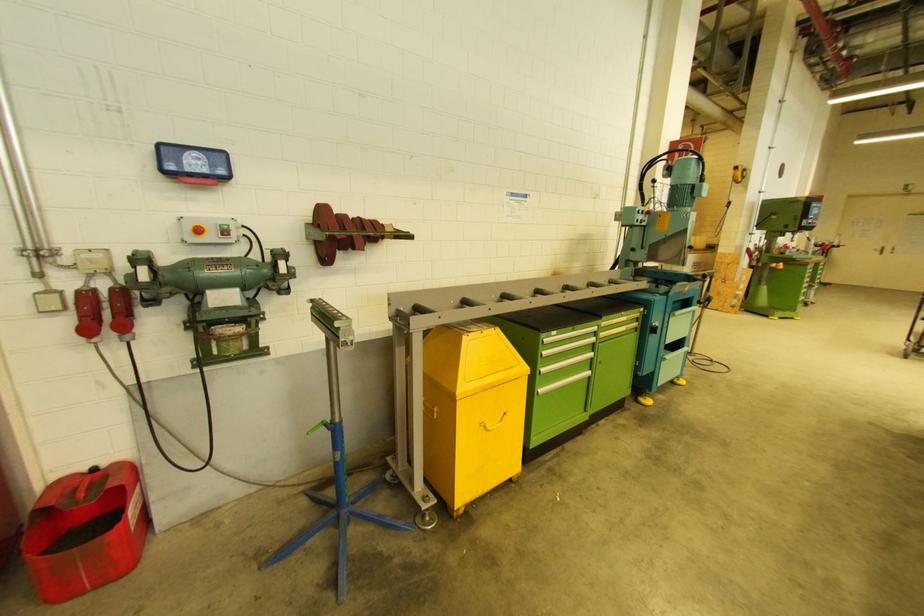
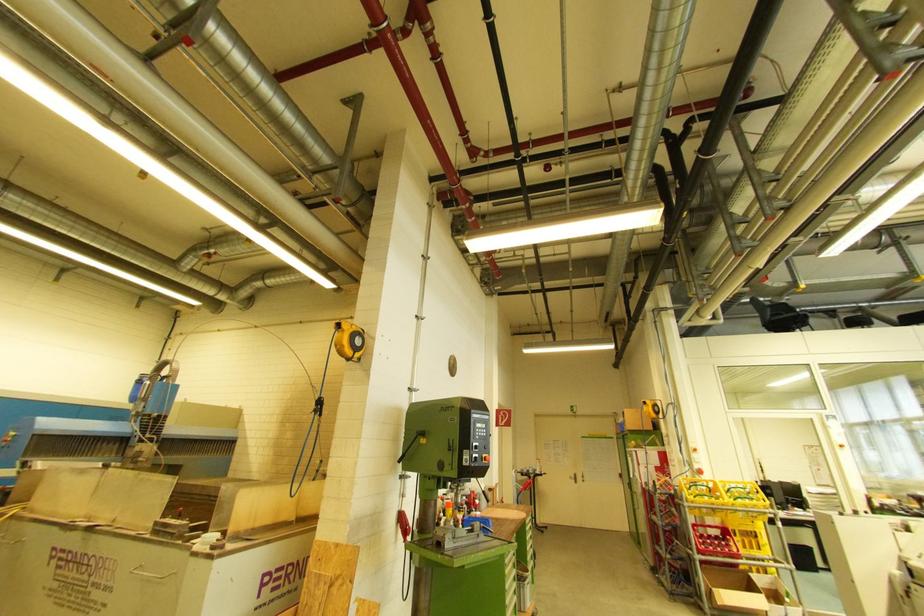
Where in the second image is the point corresponding to point (756, 225) from the first image?

(403, 456)